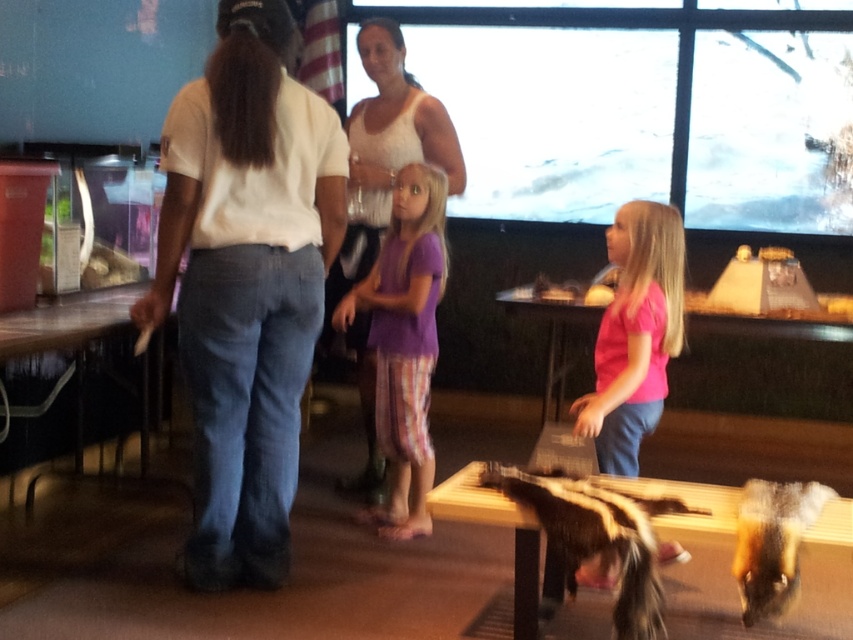
You are a visitor at the zoo and want to take a photo of both the striped fur skunk at lower center and the fluffy brown and black skunk at center. Which skunk should you aim your camera towards first if you want to capture both in one shot without moving your camera?

You should aim your camera towards the striped fur skunk at lower center first since it is positioned to the left of the fluffy brown and black skunk at center. By centering the camera on the left skunk, you can ensure both skunks are within the frame without needing to adjust the camera angle.

You are a zookeeper who needs to place a divider between the striped fur skunk at lower center and the fluffy brown and black skunk at center to ensure they don t interact. The divider you have is 12 inches long. Will it fit between them?

The striped fur skunk at lower center is 11.59 inches away from the fluffy brown and black skunk at center. Since the divider is 12 inches long, it will fit between them as it is slightly longer than the distance between the two skunks.

You are a photographer trying to capture a photo of the fluffy brown and black skunk at center. The white cotton shirt at center is blocking your view. Which direction should you move to get a better shot?

Move to the right of the fluffy brown and black skunk at center to avoid the white cotton shirt at center blocking the view since the shirt is to the left of the skunk.